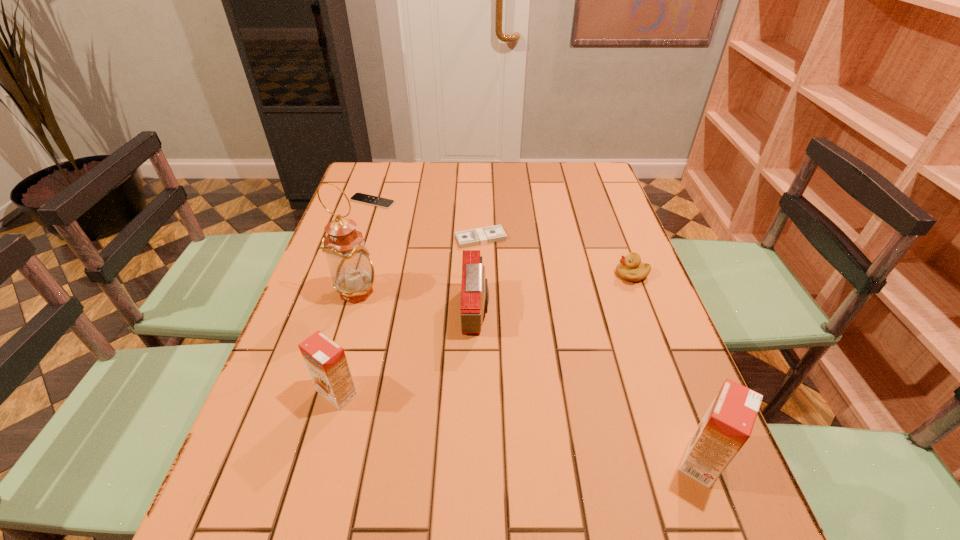
At what (x,y) coordinates should I click in order to perform the action: click on object at the far edge. Please return your answer as a coordinate pair (x, y). This screenshot has height=540, width=960. Looking at the image, I should click on (357, 197).

The height and width of the screenshot is (540, 960). I want to click on object that is at the near edge, so click(x=727, y=425).

Find the location of a particular element. The image size is (960, 540). orange juice that is at the left edge is located at coordinates (326, 361).

The width and height of the screenshot is (960, 540). I want to click on remote control that is at the left edge, so click(357, 197).

Where is `oil lamp located at the left edge`? The height and width of the screenshot is (540, 960). oil lamp located at the left edge is located at coordinates (352, 271).

Where is `orange juice situated at the right edge`? The width and height of the screenshot is (960, 540). orange juice situated at the right edge is located at coordinates (727, 425).

Find the location of a particular element. Image resolution: width=960 pixels, height=540 pixels. duckling present at the right edge is located at coordinates (630, 268).

I want to click on object located in the far left corner section of the desktop, so click(x=357, y=197).

Find the location of a particular element. The width and height of the screenshot is (960, 540). object that is at the near right corner is located at coordinates coord(727,425).

In the image, there is a desktop. Identify the location of free space at the far edge. (423, 166).